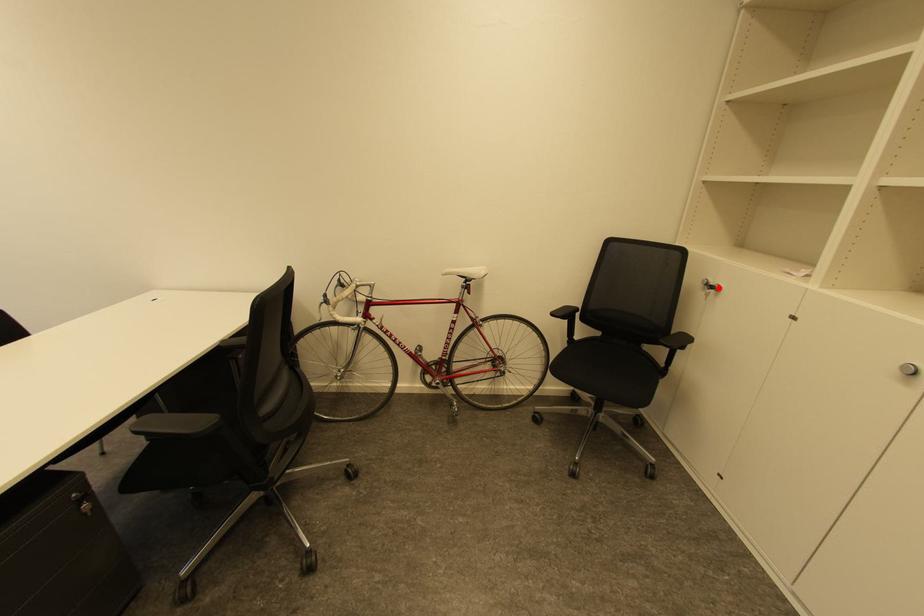
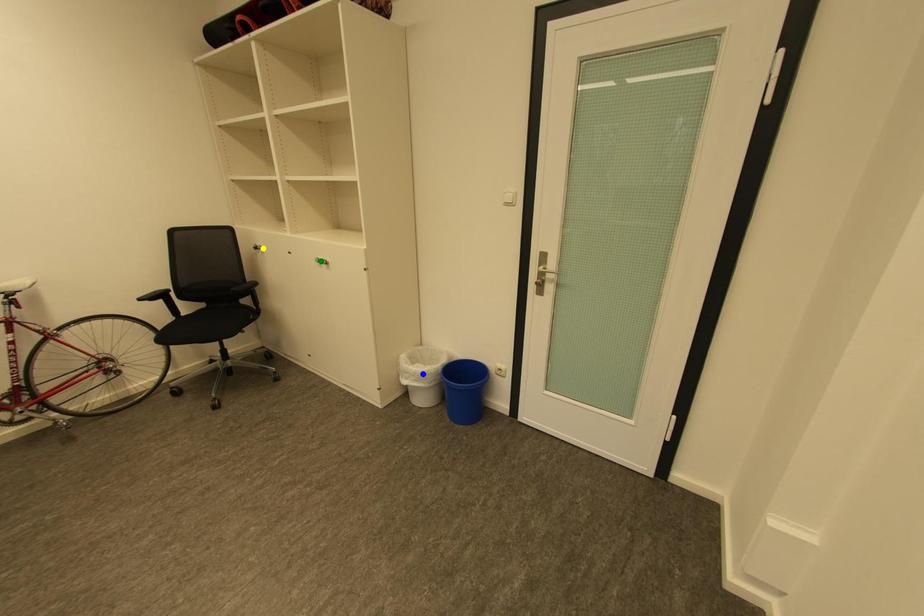
Question: I am providing you with two images of the same scene from different viewpoints. A red point is marked on the first image. You are given multiple points on the second image. In image 2, which mark is for the same physical point as the one in image 1?

Choices:
 (A) blue point
 (B) green point
 (C) yellow point

Answer: (C)